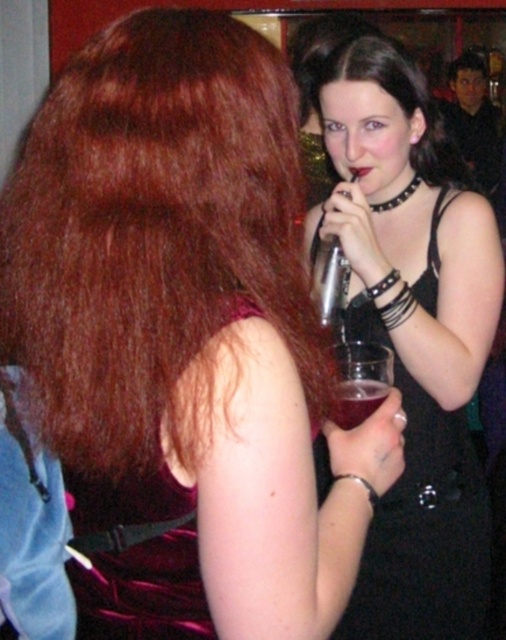
You are a photographer at a party and want to capture a photo that emphasizes the size difference between the black leather dress at center and the velvet purple dress at upper left. Which dress should you position closer to the camera to achieve this effect?

To emphasize the size difference between the black leather dress at center and the velvet purple dress at upper left, position the velvet purple dress at upper left closer to the camera. Since the black leather dress at center is already larger in size, moving the smaller velvet purple dress at upper left closer can create a visual contrast where the velvet purple dress at upper left appears larger in the frame, balancing their sizes or highlighting the difference depending on the desired effect.

You are at the party and want to move from the point at coordinates point (x=426, y=109) to the point at coordinates point (x=350, y=413). Can you walk directly towards it without passing through any obstacles?

Point (x=426, y=109) is behind point (x=350, y=413), so you cannot walk directly towards it without passing through the point at (x=350, y=413) first.